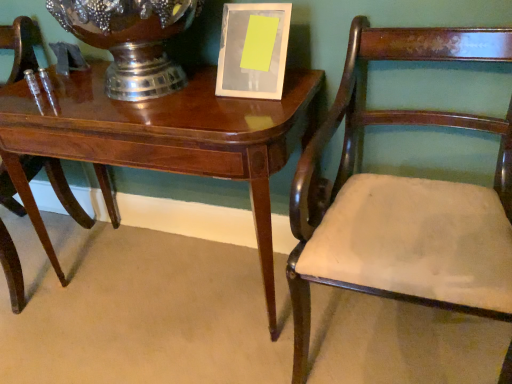
Question: Considering the positions of mahogany wood chair at left, the first chair viewed from the left, and white glossy picture frame at upper center in the image, is mahogany wood chair at left, the first chair viewed from the left, bigger or smaller than white glossy picture frame at upper center?

Choices:
 (A) small
 (B) big

Answer: (B)

Question: Would you say mahogany wood chair at left, the second chair positioned from the right, is to the left or to the right of white glossy picture frame at upper center in the picture?

Choices:
 (A) left
 (B) right

Answer: (A)

Question: Which object is the closest to the mahogany wood chair at left, the second chair positioned from the right?

Choices:
 (A) mahogany wood chair at right, positioned as the first chair in right-to-left order
 (B) white glossy picture frame at upper center
 (C) brushed metal vase at upper center
 (D) glossy wood table at center

Answer: (D)

Question: Which of these objects is positioned farthest from the glossy wood table at center?

Choices:
 (A) mahogany wood chair at right, positioned as the first chair in right-to-left order
 (B) brushed metal vase at upper center
 (C) white glossy picture frame at upper center
 (D) mahogany wood chair at left, the first chair viewed from the left

Answer: (D)